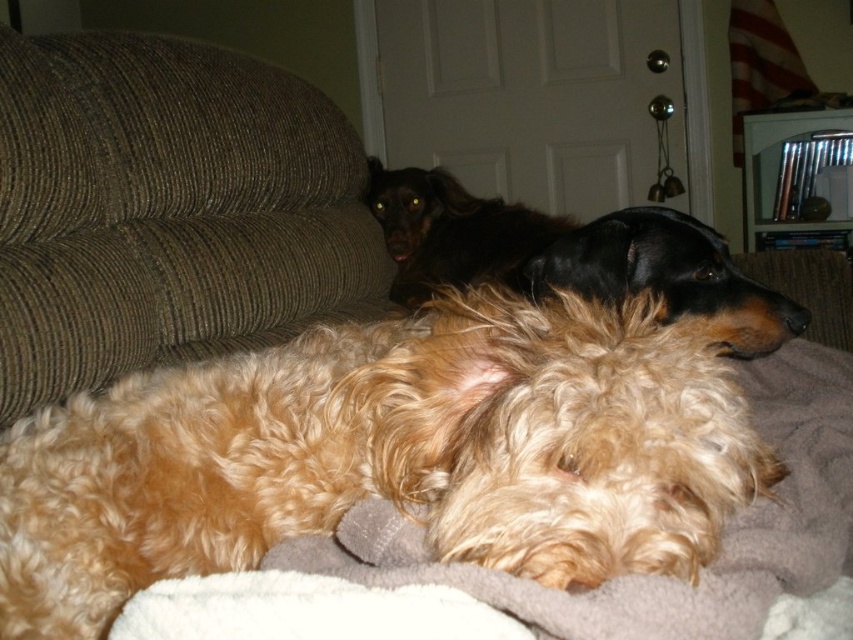
Is golden curly fur dog at center positioned at the back of shiny black coat at upper center?

No, it is not.

Is point (689, 472) more distant than point (422, 177)?

No, (689, 472) is closer to viewer.

Is point (28, 472) positioned after point (721, 316)?

No, (28, 472) is in front of (721, 316).

Locate an element on the screen. The height and width of the screenshot is (640, 853). golden curly fur dog at center is located at coordinates (386, 456).

Who is positioned more to the left, shiny black coat at upper center or black fur at center?

Positioned to the left is black fur at center.

Locate an element on the screen. This screenshot has height=640, width=853. shiny black coat at upper center is located at coordinates (572, 256).

Find the location of a particular element. shiny black coat at upper center is located at coordinates (572, 256).

Who is positioned more to the right, brown corduroy couch at upper left or black fur at center?

Positioned to the right is black fur at center.

Between brown corduroy couch at upper left and black fur at center, which one is positioned lower?

Positioned lower is black fur at center.

The width and height of the screenshot is (853, 640). I want to click on brown corduroy couch at upper left, so click(166, 209).